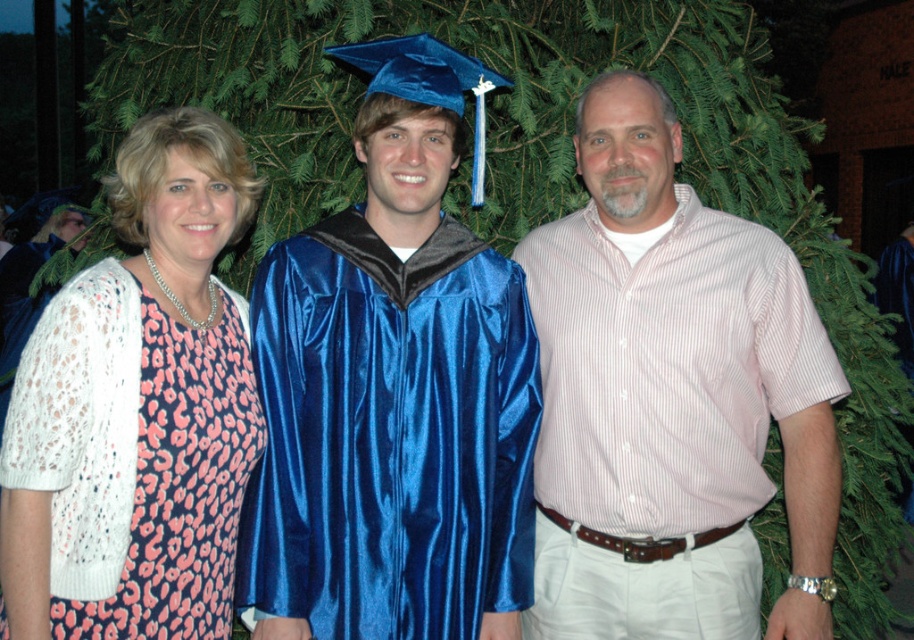
How distant is shiny blue gown at center from pink leopard print dress at left?

The distance of shiny blue gown at center from pink leopard print dress at left is 31.93 centimeters.

Can you confirm if shiny blue gown at center is positioned below pink leopard print dress at left?

No, shiny blue gown at center is not below pink leopard print dress at left.

The image size is (914, 640). Find the location of `shiny blue gown at center`. shiny blue gown at center is located at coordinates (392, 392).

Is pink striped shirt at center bigger than pink leopard print dress at left?

Yes, pink striped shirt at center is bigger than pink leopard print dress at left.

Identify the location of pink striped shirt at center. The width and height of the screenshot is (914, 640). tap(671, 397).

Locate an element on the screen. This screenshot has height=640, width=914. pink striped shirt at center is located at coordinates (671, 397).

Locate an element on the screen. The width and height of the screenshot is (914, 640). pink striped shirt at center is located at coordinates (671, 397).

Is shiny blue gown at center to the right of pink striped shirt at center from the viewer's perspective?

No, shiny blue gown at center is not to the right of pink striped shirt at center.

Can you confirm if shiny blue gown at center is taller than pink striped shirt at center?

No.

What do you see at coordinates (392, 392) in the screenshot? I see `shiny blue gown at center` at bounding box center [392, 392].

The height and width of the screenshot is (640, 914). Identify the location of shiny blue gown at center. (392, 392).